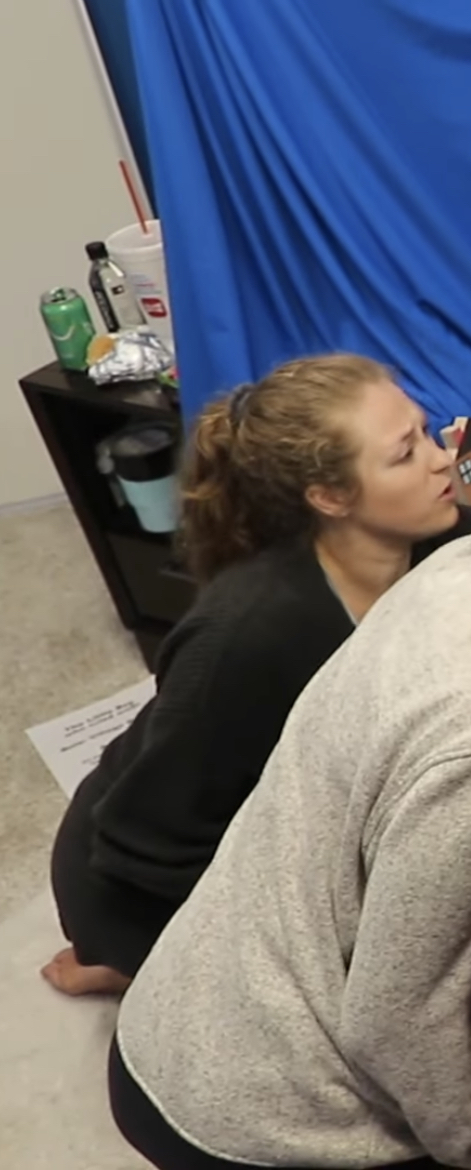
Identify the location of wall. The width and height of the screenshot is (471, 1170). (57, 204).